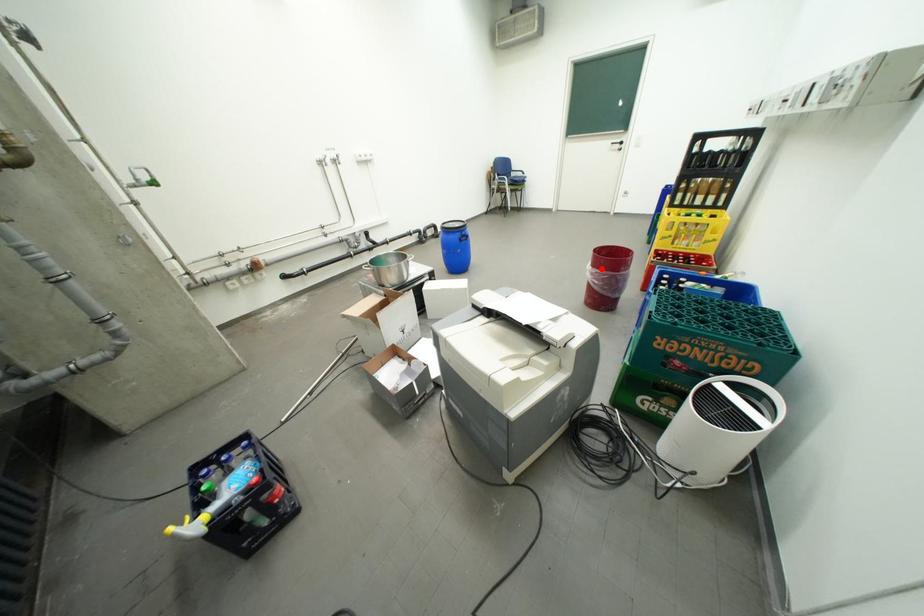
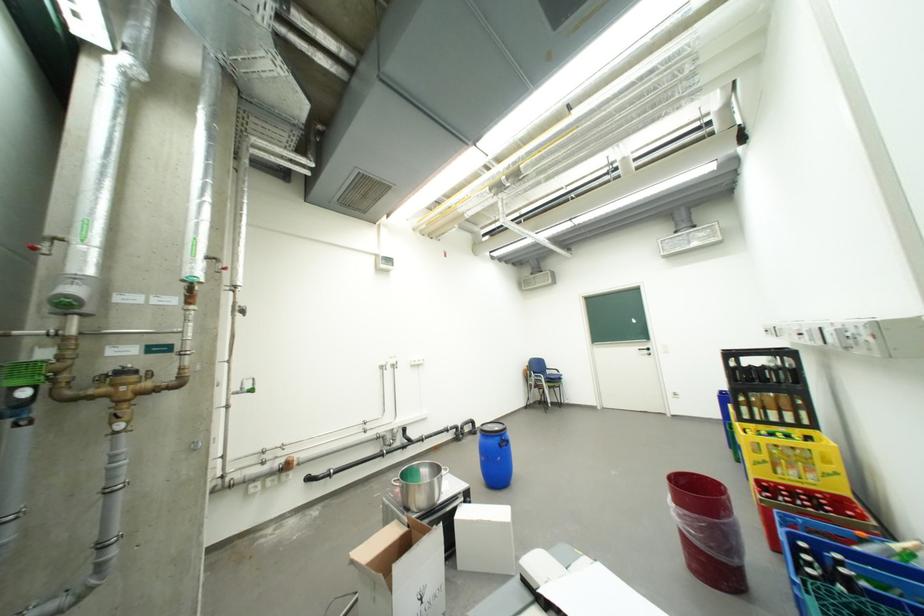
Question: I am providing you with two images of the same scene from different viewpoints. In image1, a red point is highlighted. Considering the same 3D point in image2, which of the following is correct?

Choices:
 (A) It is closer
 (B) It is farther

Answer: (B)